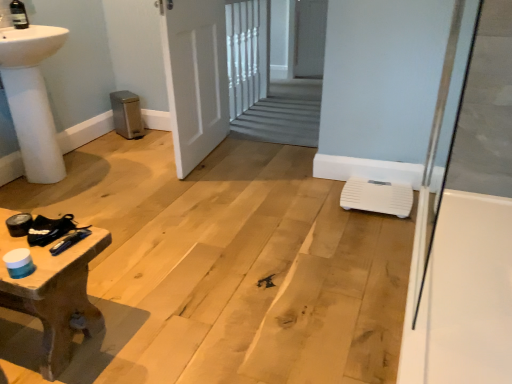
Locate an element on the screen. Image resolution: width=512 pixels, height=384 pixels. vacant area that is situated to the right of wooden textured table at lower left is located at coordinates (165, 309).